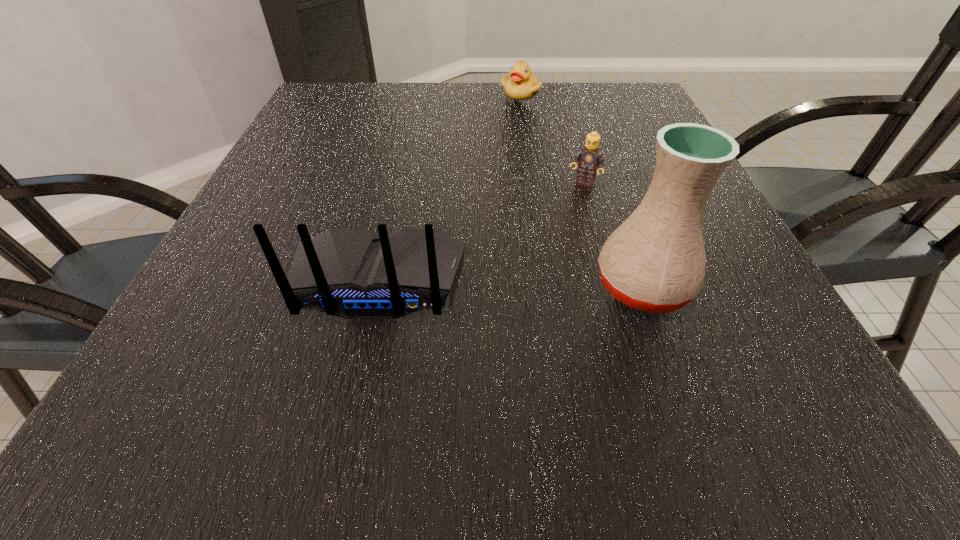
This screenshot has height=540, width=960. What are the coordinates of `the leftmost object` in the screenshot? It's located at (351, 273).

Identify the location of router. (351, 273).

Image resolution: width=960 pixels, height=540 pixels. Identify the location of the tallest object. (655, 261).

At what (x,y) coordinates should I click in order to perform the action: click on the third nearest object. Please return your answer as a coordinate pair (x, y). The width and height of the screenshot is (960, 540). Looking at the image, I should click on (589, 158).

Locate an element on the screen. the second shortest object is located at coordinates (589, 158).

You are a GUI agent. You are given a task and a screenshot of the screen. Output one action in this format:
    pyautogui.click(x=<x>, y=<y>)
    Task: Click on the second object from left to right
    The height and width of the screenshot is (540, 960).
    Given the screenshot: What is the action you would take?
    [x=522, y=84]

Locate an element on the screen. This screenshot has height=540, width=960. the shortest object is located at coordinates (522, 84).

Locate an element on the screen. The height and width of the screenshot is (540, 960). vacant space positioned on the back of the second tallest object is located at coordinates (359, 374).

Locate an element on the screen. Image resolution: width=960 pixels, height=540 pixels. vacant area situated on the left of the pottery is located at coordinates (484, 286).

Identify the location of vacant area situated in front of the third nearest object. (565, 220).